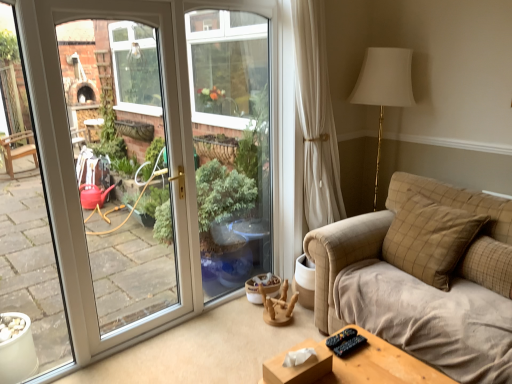
This screenshot has height=384, width=512. Describe the element at coordinates (430, 239) in the screenshot. I see `brown velvety pillow at right, which is the 2th pillow in right-to-left order` at that location.

Locate an element on the screen. brown velvety pillow at right, which is counted as the 1th pillow, starting from the left is located at coordinates (430, 239).

The height and width of the screenshot is (384, 512). What do you see at coordinates (488, 265) in the screenshot?
I see `brown checkered pillow at right, positioned as the second pillow in left-to-right order` at bounding box center [488, 265].

How much space does brown checkered pillow at right, which appears as the first pillow when viewed from the right, occupy horizontally?

brown checkered pillow at right, which appears as the first pillow when viewed from the right, is 8.11 inches wide.

This screenshot has width=512, height=384. I want to click on brown checkered pillow at right, which appears as the first pillow when viewed from the right, so click(488, 265).

How much space does brown checkered pillow at right, which appears as the first pillow when viewed from the right, occupy vertically?

The height of brown checkered pillow at right, which appears as the first pillow when viewed from the right, is 13.64 inches.

This screenshot has width=512, height=384. Identify the location of brown velvety pillow at right, which is the 2th pillow in right-to-left order. (430, 239).

Visually, is brown checkered pillow at right, which appears as the first pillow when viewed from the right, positioned to the left or to the right of brown velvety pillow at right, which is the 2th pillow in right-to-left order?

From the image, it's evident that brown checkered pillow at right, which appears as the first pillow when viewed from the right, is to the right of brown velvety pillow at right, which is the 2th pillow in right-to-left order.

In the image, is brown checkered pillow at right, positioned as the second pillow in left-to-right order, positioned in front of or behind brown velvety pillow at right, which is the 2th pillow in right-to-left order?

Visually, brown checkered pillow at right, positioned as the second pillow in left-to-right order, is located in front of brown velvety pillow at right, which is the 2th pillow in right-to-left order.

From the picture: Which is closer to the camera, (x=478, y=252) or (x=416, y=214)?

Point (x=478, y=252).

From the image's perspective, between brown checkered pillow at right, which appears as the first pillow when viewed from the right, and brown velvety pillow at right, which is the 2th pillow in right-to-left order, who is located below?

brown checkered pillow at right, which appears as the first pillow when viewed from the right, is shown below in the image.

From the picture: From a real-world perspective, is brown checkered pillow at right, which appears as the first pillow when viewed from the right, positioned above or below brown velvety pillow at right, which is the 2th pillow in right-to-left order?

brown checkered pillow at right, which appears as the first pillow when viewed from the right, is situated lower than brown velvety pillow at right, which is the 2th pillow in right-to-left order, in the real world.

Which of these two, brown checkered pillow at right, which appears as the first pillow when viewed from the right, or brown velvety pillow at right, which is the 2th pillow in right-to-left order, is thinner?

brown checkered pillow at right, which appears as the first pillow when viewed from the right, is thinner.

Considering the relative sizes of brown checkered pillow at right, positioned as the second pillow in left-to-right order, and brown velvety pillow at right, which is the 2th pillow in right-to-left order, in the image provided, is brown checkered pillow at right, positioned as the second pillow in left-to-right order, shorter than brown velvety pillow at right, which is the 2th pillow in right-to-left order,?

Indeed, brown checkered pillow at right, positioned as the second pillow in left-to-right order, has a lesser height compared to brown velvety pillow at right, which is the 2th pillow in right-to-left order.

Considering the relative sizes of brown checkered pillow at right, which appears as the first pillow when viewed from the right, and brown velvety pillow at right, which is counted as the 1th pillow, starting from the left, in the image provided, is brown checkered pillow at right, which appears as the first pillow when viewed from the right, bigger than brown velvety pillow at right, which is counted as the 1th pillow, starting from the left,?

Incorrect, brown checkered pillow at right, which appears as the first pillow when viewed from the right, is not larger than brown velvety pillow at right, which is counted as the 1th pillow, starting from the left.

Is brown checkered pillow at right, positioned as the second pillow in left-to-right order, positioned beyond the bounds of brown velvety pillow at right, which is counted as the 1th pillow, starting from the left?

Yes, brown checkered pillow at right, positioned as the second pillow in left-to-right order, is located beyond the bounds of brown velvety pillow at right, which is counted as the 1th pillow, starting from the left.

Is brown checkered pillow at right, which appears as the first pillow when viewed from the right, directly adjacent to brown velvety pillow at right, which is counted as the 1th pillow, starting from the left?

No.

Could you tell me if brown checkered pillow at right, which appears as the first pillow when viewed from the right, is turned towards brown velvety pillow at right, which is counted as the 1th pillow, starting from the left?

No, brown checkered pillow at right, which appears as the first pillow when viewed from the right, does not turn towards brown velvety pillow at right, which is counted as the 1th pillow, starting from the left.

How many degrees apart are the facing directions of brown checkered pillow at right, positioned as the second pillow in left-to-right order, and brown velvety pillow at right, which is the 2th pillow in right-to-left order?

brown checkered pillow at right, positioned as the second pillow in left-to-right order, and brown velvety pillow at right, which is the 2th pillow in right-to-left order, are facing 1.22 degrees away from each other.

This screenshot has height=384, width=512. What are the coordinates of `pillow lying below the brown velvety pillow at right, which is counted as the 1th pillow, starting from the left (from the image's perspective)` in the screenshot? It's located at (488, 265).

Between brown velvety pillow at right, which is counted as the 1th pillow, starting from the left, and brown checkered pillow at right, positioned as the second pillow in left-to-right order, which one appears on the right side from the viewer's perspective?

brown checkered pillow at right, positioned as the second pillow in left-to-right order.

Is brown velvety pillow at right, which is the 2th pillow in right-to-left order, behind brown checkered pillow at right, positioned as the second pillow in left-to-right order?

Yes, it is behind brown checkered pillow at right, positioned as the second pillow in left-to-right order.

Considering the points (449, 246) and (464, 255), which point is behind, point (449, 246) or point (464, 255)?

The point (464, 255) is farther.

From the image's perspective, does brown velvety pillow at right, which is counted as the 1th pillow, starting from the left, appear higher than brown checkered pillow at right, which appears as the first pillow when viewed from the right?

Yes, from the image's perspective, brown velvety pillow at right, which is counted as the 1th pillow, starting from the left, is on top of brown checkered pillow at right, which appears as the first pillow when viewed from the right.

From a real-world perspective, is brown velvety pillow at right, which is counted as the 1th pillow, starting from the left, on top of brown checkered pillow at right, positioned as the second pillow in left-to-right order?

Yes, from a real-world perspective, brown velvety pillow at right, which is counted as the 1th pillow, starting from the left, is above brown checkered pillow at right, positioned as the second pillow in left-to-right order.

Between brown velvety pillow at right, which is counted as the 1th pillow, starting from the left, and brown checkered pillow at right, which appears as the first pillow when viewed from the right, which one has larger width?

brown velvety pillow at right, which is counted as the 1th pillow, starting from the left.

Between brown velvety pillow at right, which is the 2th pillow in right-to-left order, and brown checkered pillow at right, positioned as the second pillow in left-to-right order, which one has less height?

brown checkered pillow at right, positioned as the second pillow in left-to-right order, is shorter.

Does brown velvety pillow at right, which is counted as the 1th pillow, starting from the left, have a larger size compared to brown checkered pillow at right, positioned as the second pillow in left-to-right order?

Indeed, brown velvety pillow at right, which is counted as the 1th pillow, starting from the left, has a larger size compared to brown checkered pillow at right, positioned as the second pillow in left-to-right order.

Is brown velvety pillow at right, which is counted as the 1th pillow, starting from the left, not inside brown checkered pillow at right, which appears as the first pillow when viewed from the right?

brown velvety pillow at right, which is counted as the 1th pillow, starting from the left, is positioned outside brown checkered pillow at right, which appears as the first pillow when viewed from the right.

Is there a large distance between brown velvety pillow at right, which is the 2th pillow in right-to-left order, and brown checkered pillow at right, positioned as the second pillow in left-to-right order?

brown velvety pillow at right, which is the 2th pillow in right-to-left order, is actually quite close to brown checkered pillow at right, positioned as the second pillow in left-to-right order.

From the picture: Could you tell me if brown velvety pillow at right, which is counted as the 1th pillow, starting from the left, is turned towards brown checkered pillow at right, which appears as the first pillow when viewed from the right?

No, brown velvety pillow at right, which is counted as the 1th pillow, starting from the left, is not aimed at brown checkered pillow at right, which appears as the first pillow when viewed from the right.

Measure the distance between brown velvety pillow at right, which is the 2th pillow in right-to-left order, and brown checkered pillow at right, positioned as the second pillow in left-to-right order.

brown velvety pillow at right, which is the 2th pillow in right-to-left order, is 7.42 inches away from brown checkered pillow at right, positioned as the second pillow in left-to-right order.

Locate an element on the screen. The height and width of the screenshot is (384, 512). pillow above the brown checkered pillow at right, which appears as the first pillow when viewed from the right (from a real-world perspective) is located at coordinates (430, 239).

Identify the location of pillow on the right of brown velvety pillow at right, which is the 2th pillow in right-to-left order. (488, 265).

This screenshot has height=384, width=512. I want to click on pillow lying behind the brown checkered pillow at right, positioned as the second pillow in left-to-right order, so 430,239.